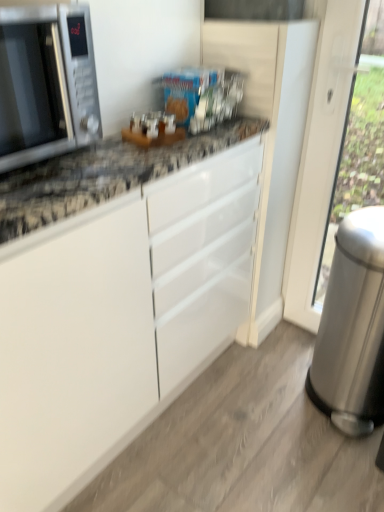
The width and height of the screenshot is (384, 512). What do you see at coordinates (352, 327) in the screenshot?
I see `silver metallic trash can at right` at bounding box center [352, 327].

Identify the location of silver metallic trash can at right. (352, 327).

Measure the distance between point (48, 83) and camera.

They are 85.50 centimeters apart.

The image size is (384, 512). What do you see at coordinates (46, 83) in the screenshot? I see `satin silver microwave at left` at bounding box center [46, 83].

Measure the distance between satin silver microwave at left and camera.

A distance of 30.15 inches exists between satin silver microwave at left and camera.

Identify the location of satin silver microwave at left. The width and height of the screenshot is (384, 512). (46, 83).

The image size is (384, 512). What are the coordinates of `silver metallic trash can at right` in the screenshot? It's located at (352, 327).

Visually, is satin silver microwave at left positioned to the left or to the right of silver metallic trash can at right?

satin silver microwave at left is to the left of silver metallic trash can at right.

In the scene shown: Which object is closer to the camera taking this photo, satin silver microwave at left or silver metallic trash can at right?

satin silver microwave at left is more forward.

Which is nearer, (59, 49) or (335, 296)?

Point (59, 49) is closer to the camera than point (335, 296).

From the image's perspective, is satin silver microwave at left on top of silver metallic trash can at right?

Yes, from the image's perspective, satin silver microwave at left is above silver metallic trash can at right.

From a real-world perspective, is satin silver microwave at left above or below silver metallic trash can at right?

From a real-world perspective, satin silver microwave at left is physically above silver metallic trash can at right.

Between satin silver microwave at left and silver metallic trash can at right, which one has smaller width?

Thinner between the two is silver metallic trash can at right.

Considering the relative sizes of satin silver microwave at left and silver metallic trash can at right in the image provided, is satin silver microwave at left shorter than silver metallic trash can at right?

Yes, satin silver microwave at left is shorter than silver metallic trash can at right.

Who is bigger, satin silver microwave at left or silver metallic trash can at right?

Bigger between the two is silver metallic trash can at right.

Would you say satin silver microwave at left is inside or outside silver metallic trash can at right?

satin silver microwave at left is outside silver metallic trash can at right.

Is satin silver microwave at left far away from silver metallic trash can at right?

Actually, satin silver microwave at left and silver metallic trash can at right are a little close together.

Could you tell me if satin silver microwave at left is facing silver metallic trash can at right?

No, satin silver microwave at left is not facing towards silver metallic trash can at right.

Measure the distance between satin silver microwave at left and silver metallic trash can at right.

The distance of satin silver microwave at left from silver metallic trash can at right is 87.76 centimeters.

Find the location of a particular element. microwave oven in front of the silver metallic trash can at right is located at coordinates (46, 83).

Is silver metallic trash can at right at the right side of satin silver microwave at left?

Yes.

Relative to satin silver microwave at left, is silver metallic trash can at right in front or behind?

Clearly, silver metallic trash can at right is behind satin silver microwave at left.

Does point (380, 373) come farther from viewer compared to point (8, 115)?

Yes, point (380, 373) is farther from viewer.

From the image's perspective, is silver metallic trash can at right above satin silver microwave at left?

No, from the image's perspective, silver metallic trash can at right is not over satin silver microwave at left.

From a real-world perspective, which object stands above the other?

satin silver microwave at left, from a real-world perspective.

Can you confirm if silver metallic trash can at right is wider than satin silver microwave at left?

Incorrect, the width of silver metallic trash can at right does not surpass that of satin silver microwave at left.

Can you confirm if silver metallic trash can at right is taller than satin silver microwave at left?

Indeed, silver metallic trash can at right has a greater height compared to satin silver microwave at left.

Looking at the image, does silver metallic trash can at right seem bigger or smaller compared to satin silver microwave at left?

In the image, silver metallic trash can at right appears to be larger than satin silver microwave at left.

Could satin silver microwave at left be considered to be inside silver metallic trash can at right?

No, satin silver microwave at left is not surrounded by silver metallic trash can at right.

Are silver metallic trash can at right and satin silver microwave at left beside each other?

They are not placed beside each other.

Is silver metallic trash can at right looking in the opposite direction of satin silver microwave at left?

silver metallic trash can at right does not have its back to satin silver microwave at left.

At what (x,y) coordinates should I click in order to perform the action: click on microwave oven above the silver metallic trash can at right (from a real-world perspective). Please return your answer as a coordinate pair (x, y). This screenshot has height=512, width=384. Looking at the image, I should click on (46, 83).

Where is `appliance on the right side of satin silver microwave at left`? This screenshot has width=384, height=512. appliance on the right side of satin silver microwave at left is located at coordinates (352, 327).

Locate an element on the screen. appliance that appears below the satin silver microwave at left (from a real-world perspective) is located at coordinates (352, 327).